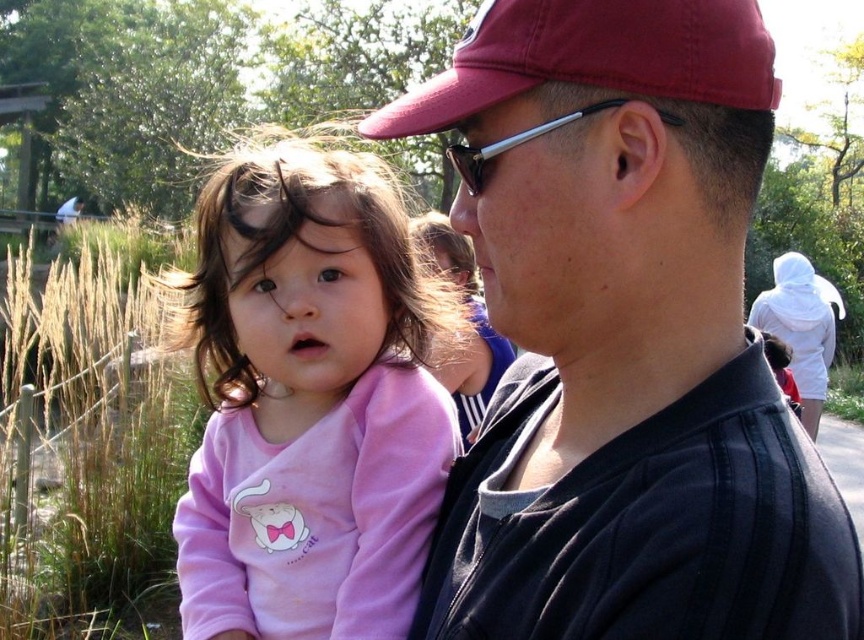
Question: Can you confirm if matte black shirt at center is bigger than pink fleece at center?

Choices:
 (A) no
 (B) yes

Answer: (A)

Question: Does matte black shirt at center appear on the left side of pink fleece at center?

Choices:
 (A) no
 (B) yes

Answer: (A)

Question: Estimate the real-world distances between objects in this image. Which object is closer to the maroon fabric baseball cap at center?

Choices:
 (A) matte black shirt at center
 (B) pink fleece at center

Answer: (A)

Question: Which is farther from the maroon fabric baseball cap at center?

Choices:
 (A) pink fleece at center
 (B) matte black shirt at center

Answer: (A)

Question: Which point is closer to the camera?

Choices:
 (A) (221, 225)
 (B) (674, 4)

Answer: (B)

Question: Can you confirm if matte black shirt at center is bigger than maroon fabric baseball cap at center?

Choices:
 (A) no
 (B) yes

Answer: (B)